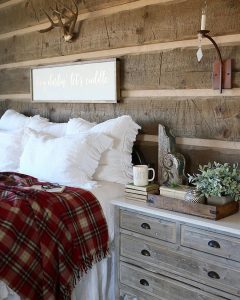
You are a GUI agent. You are given a task and a screenshot of the screen. Output one action in this format:
    pyautogui.click(x=<x>, y=<y>)
    Task: Click on the shelves beige
    This screenshot has height=300, width=240.
    Given the screenshot: What is the action you would take?
    tap(114, 8), tap(13, 2), tap(155, 39), tap(178, 91), tap(217, 142)